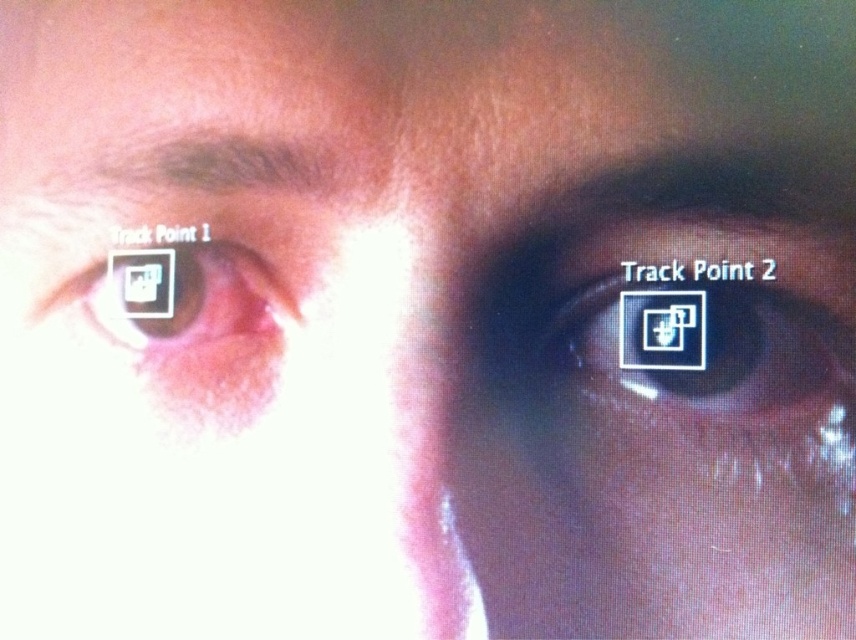
You are a technician adjusting a new eye tracking device. The device requires that the distance between the user and the tracking point must be at least 35 inches to ensure accurate readings. You notice the point labeled as point (652, 339) in the image. Is the current distance sufficient for accurate readings?

The distance between point (652, 339) and the viewer is 34.69 inches. Since the required minimum distance is 35 inches, the current distance is insufficient for accurate readings.

You are a researcher analyzing eye tracking data. You observe two matte black eyes in the image. Which of the two eyes, the matte black eye at right or the matte black eye at left, has a smaller vertical dimension?

The matte black eye at right is shorter than the matte black eye at left, so the matte black eye at right has a smaller vertical dimension.

Based on the scene description, which of the two points, point (565, 346) or point (207, 317), is closer to the viewer?

Point (565, 346) is closer to the viewer because it is in front of point (207, 317) according to the description.